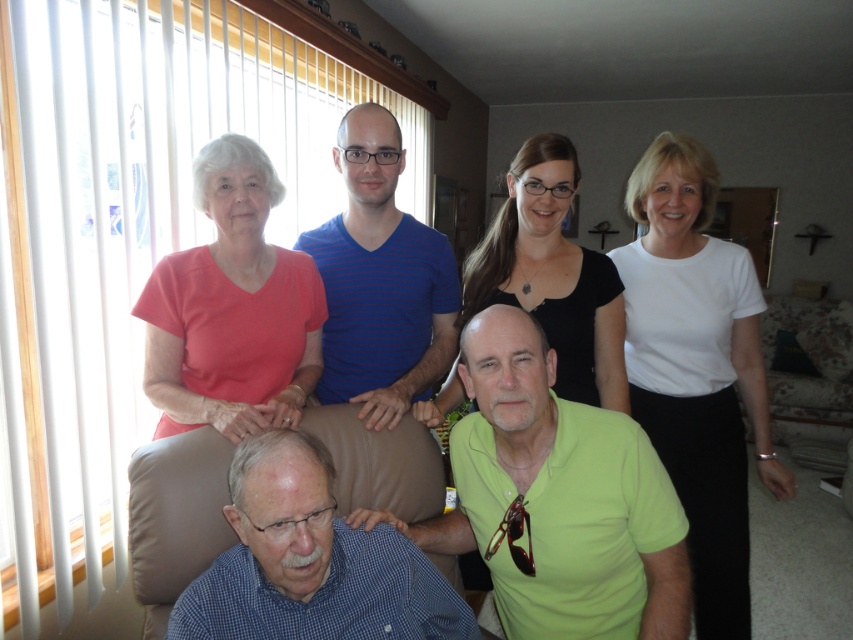
You are standing in the living room and want to place a small plant between the two points marked as point (525, 348) and point (461, 317). Which point should the plant be closer to in order to be nearer to the seated man in the beige armchair?

The plant should be closer to point (525, 348) because it is closer to the viewer, and the seated man in the beige armchair is in the foreground, meaning that point (525, 348) is nearer to him.

Consider the image. You are standing in the living room and want to place a small plant between the two points marked as point (575, 550) and point (332, 520). Since the plant needs to be placed closer to the viewer, which point should you position it near?

The point (575, 550) is closer to the viewer than point (332, 520), so you should position the plant near point (575, 550) to place it closer to the viewer.

You are a photographer adjusting the lighting in the room. You notice the green matte shirt at center and the blue checkered shirt at lower left. Which shirt should you focus the light on to ensure both are well lit, considering their sizes?

The green matte shirt at center has a larger width than the blue checkered shirt at lower left, so you should focus the light on the green matte shirt at center to ensure both are well lit.